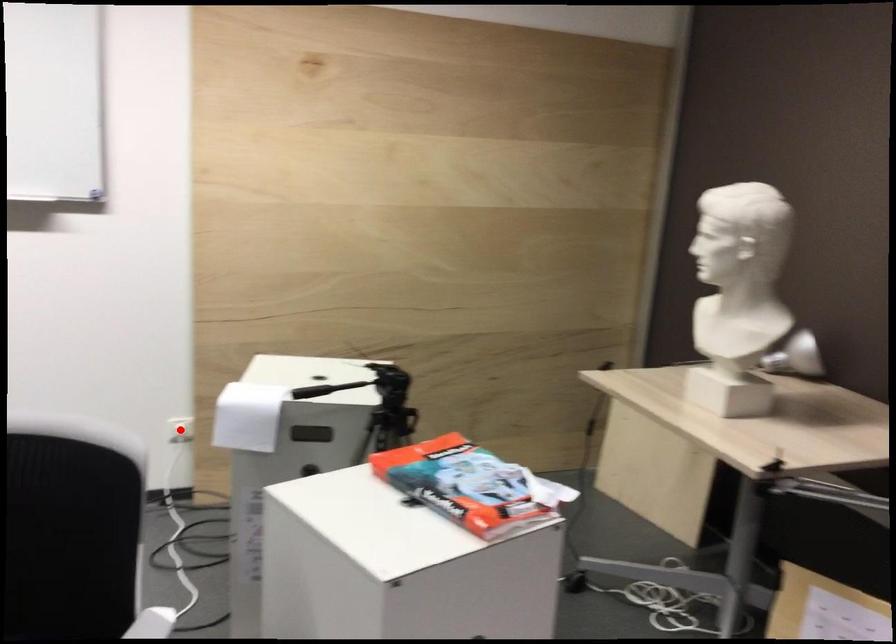
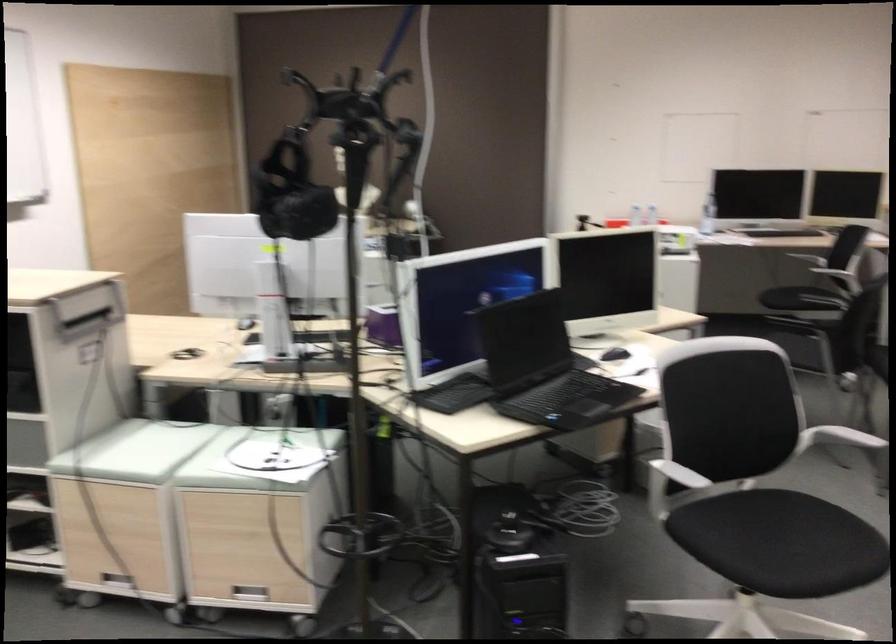
Question: I am providing you with two images of the same scene from different viewpoints. A red point is marked on the first image. Is the red point's position out of view in image 2?

Choices:
 (A) Yes
 (B) No

Answer: (A)